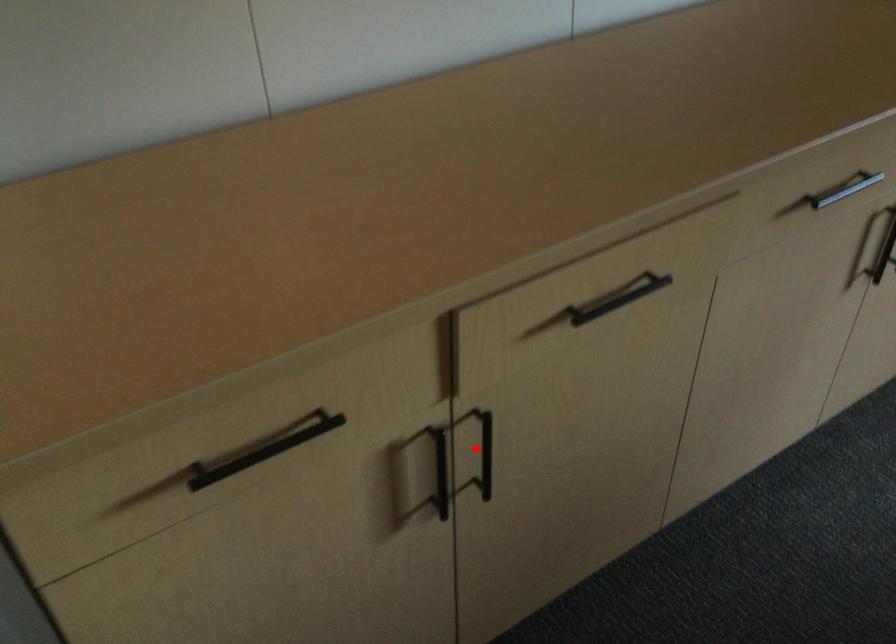
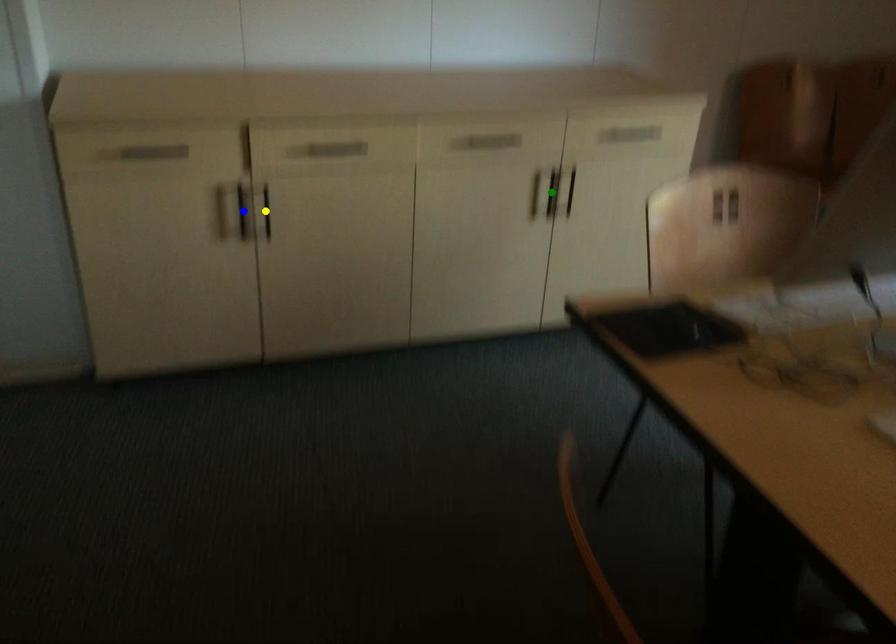
Question: I am providing you with two images of the same scene from different viewpoints. A red point is marked on the first image. You are given multiple points on the second image. Which point in image 2 represents the same 3d spot as the red point in image 1?

Choices:
 (A) green point
 (B) blue point
 (C) yellow point

Answer: (C)